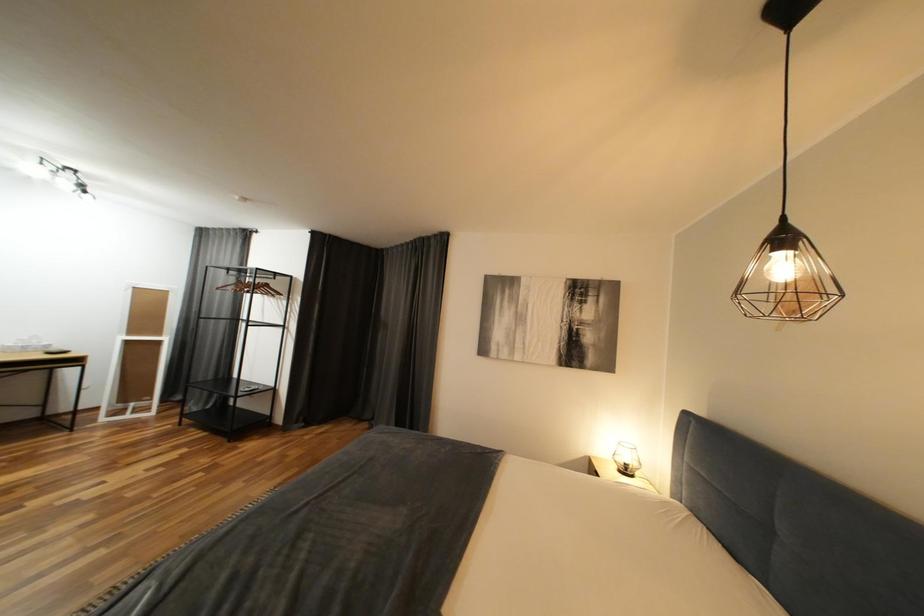
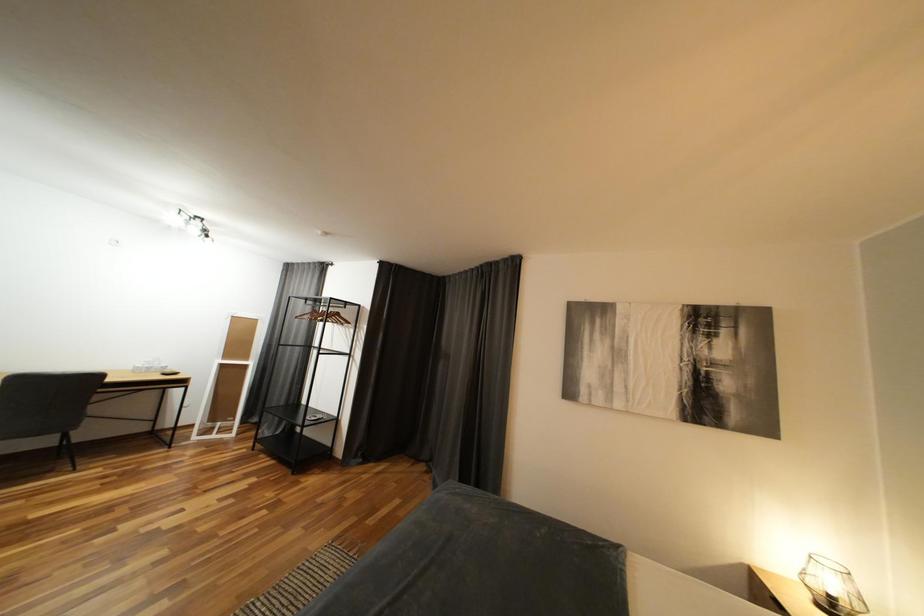
Question: The camera is either moving clockwise (left) or counter-clockwise (right) around the object. The first image is from the beginning of the video and the second image is from the end. Is the camera moving left or right when shooting the video?

Choices:
 (A) Left
 (B) Right

Answer: (B)